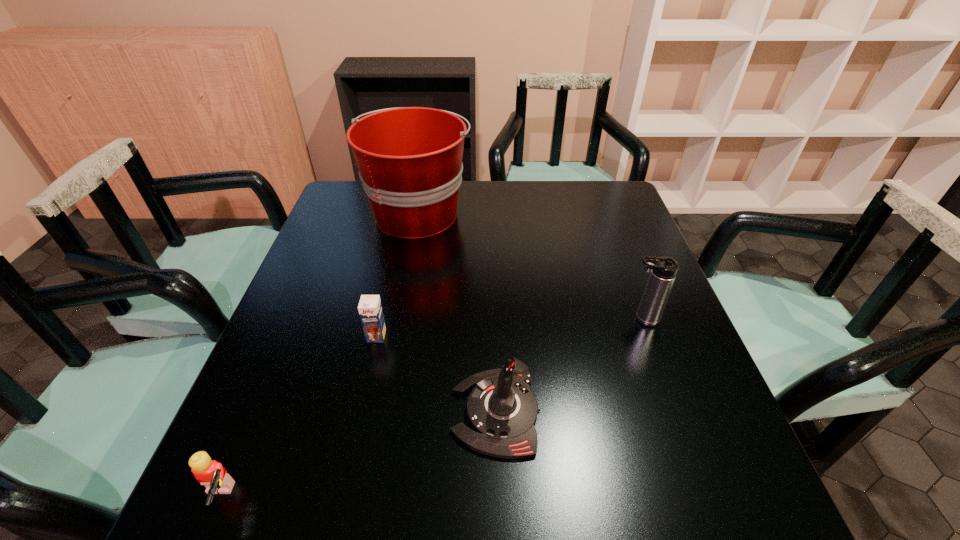
Image resolution: width=960 pixels, height=540 pixels. Identify the location of bucket at the left edge. (410, 163).

The width and height of the screenshot is (960, 540). Identify the location of Lego situated at the left edge. (210, 473).

Find the location of a particular element. This screenshot has height=540, width=960. object that is at the right edge is located at coordinates (663, 269).

Identify the location of object that is at the far left corner. This screenshot has width=960, height=540. (410, 163).

At what (x,y) coordinates should I click in order to perform the action: click on object at the near left corner. Please return your answer as a coordinate pair (x, y). This screenshot has width=960, height=540. Looking at the image, I should click on (210, 473).

Locate an element on the screen. vacant space at the far edge of the desktop is located at coordinates (512, 212).

Locate an element on the screen. free space at the near edge of the desktop is located at coordinates (525, 504).

In the image, there is a desktop. At what (x,y) coordinates should I click in order to perform the action: click on free space at the left edge. Please return your answer as a coordinate pair (x, y). The width and height of the screenshot is (960, 540). Looking at the image, I should click on (341, 280).

The image size is (960, 540). Find the location of `vacant area at the right edge`. vacant area at the right edge is located at coordinates (724, 432).

Where is `blank area at the near left corner`? The image size is (960, 540). blank area at the near left corner is located at coordinates (202, 501).